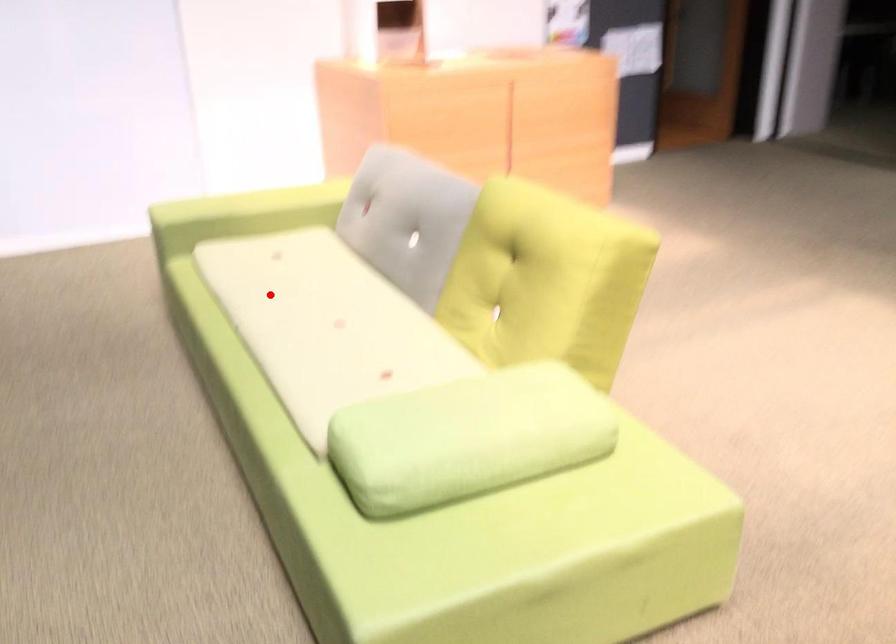
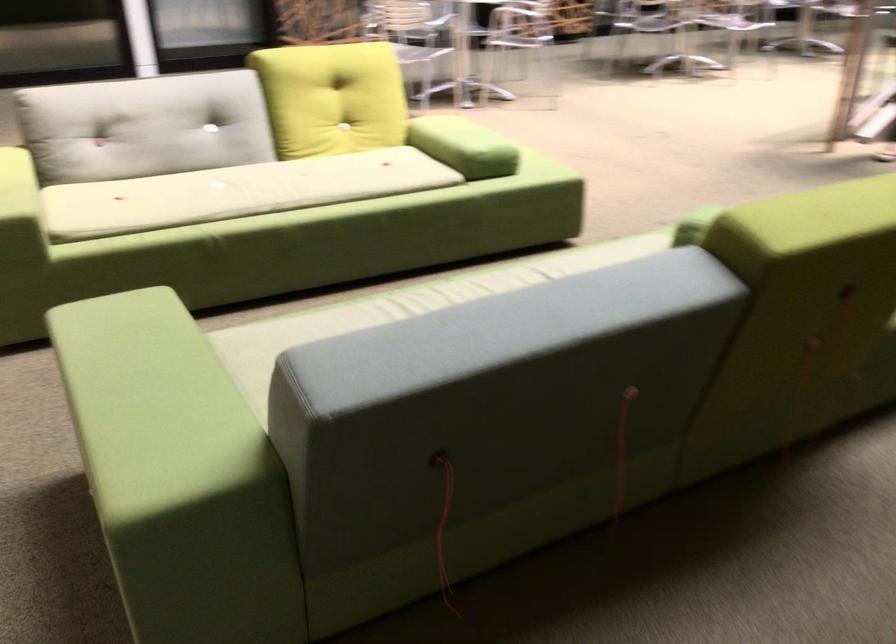
Question: I am providing you with two images of the same scene from different viewpoints. Given a red point in image1, look at the same physical point in image2. Is it:

Choices:
 (A) Closer to the viewpoint
 (B) Farther from the viewpoint

Answer: (B)